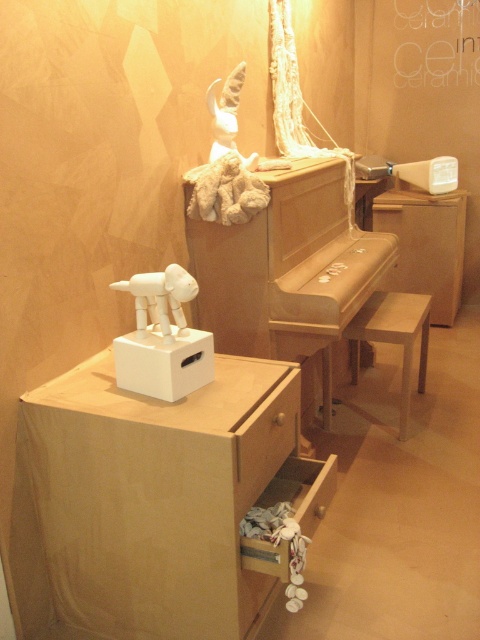
Question: Observing the image, what is the correct spatial positioning of wooden drawer at lower center in reference to fuzzy beige stuffed animal at upper center?

Choices:
 (A) right
 (B) left

Answer: (A)

Question: Estimate the real-world distances between objects in this image. Which object is farther from the fuzzy beige stuffed animal at upper center?

Choices:
 (A) matte wood piano at center
 (B) white matte elephant at center
 (C) wooden drawer at lower center

Answer: (C)

Question: Which point is farther to the camera?

Choices:
 (A) white matte box at center
 (B) matte wood piano at center
 (C) fuzzy beige stuffed animal at upper center

Answer: (B)

Question: Which object is positioned closest to the white matte stool at center?

Choices:
 (A) matte wood piano at center
 (B) white matte elephant at center

Answer: (A)

Question: Is white matte box at center further to the viewer compared to white matte elephant at center?

Choices:
 (A) no
 (B) yes

Answer: (B)

Question: Is wooden drawer at lower center smaller than white matte elephant at center?

Choices:
 (A) yes
 (B) no

Answer: (B)